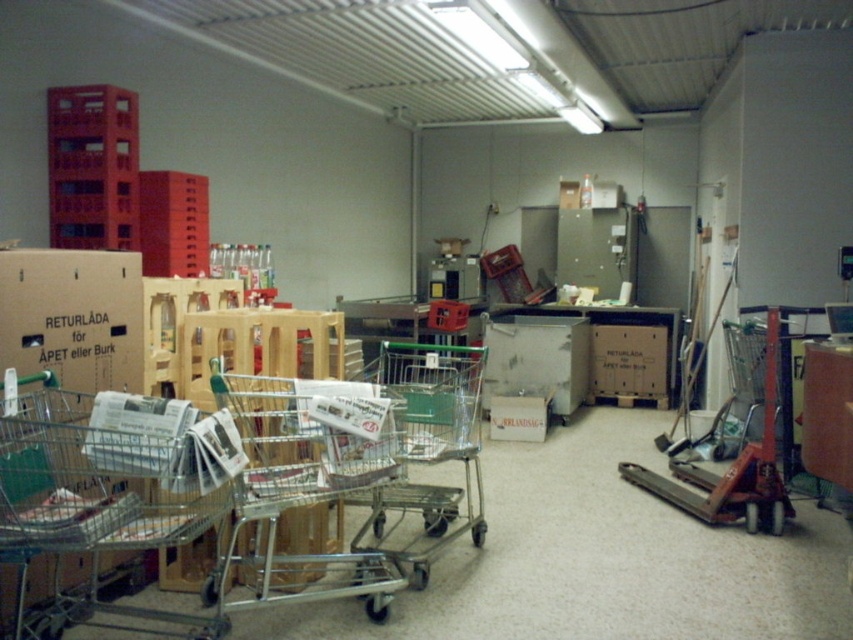
Question: Which point is farther from the camera taking this photo?

Choices:
 (A) (16, 477)
 (B) (433, 388)

Answer: (B)

Question: Which point is closer to the camera?

Choices:
 (A) (306, 412)
 (B) (363, 524)
 (C) (136, 496)
 (D) (740, 451)

Answer: (C)

Question: In this image, where is metallic silver shopping cart at left located relative to green metallic shopping cart at center?

Choices:
 (A) above
 (B) below

Answer: (A)

Question: Is metallic silver shopping cart at left to the left of orange metallic trolley at center right from the viewer's perspective?

Choices:
 (A) yes
 (B) no

Answer: (A)

Question: Can you confirm if green metallic shopping cart at center is positioned above orange metallic trolley at center right?

Choices:
 (A) yes
 (B) no

Answer: (B)

Question: Based on their relative distances, which object is nearer to the green metallic shopping cart at center?

Choices:
 (A) orange metallic trolley at center right
 (B) metallic silver shopping cart at left
 (C) silver metallic shopping cart at center

Answer: (C)